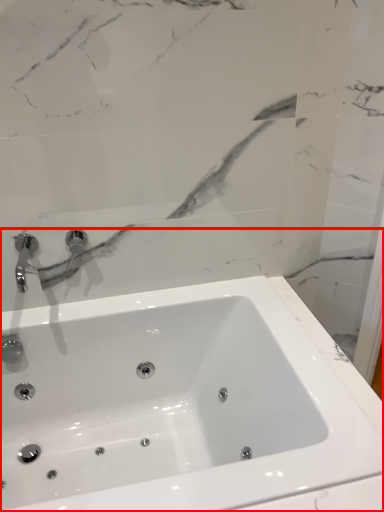
Question: In this image, where is sink (annotated by the red box) located relative to tap?

Choices:
 (A) left
 (B) right

Answer: (B)